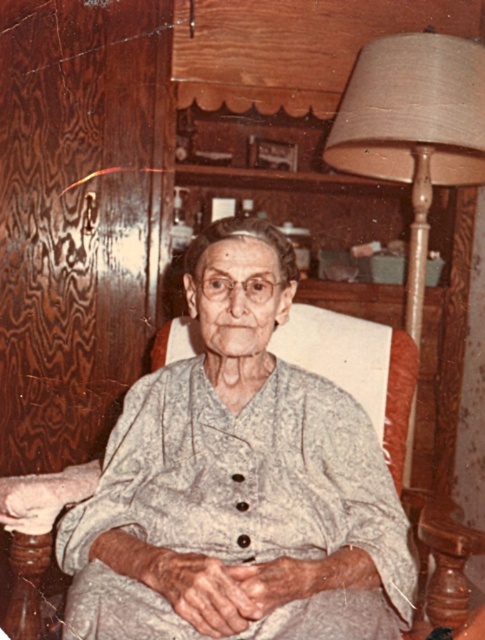
Question: Can you confirm if white textured dress at center is smaller than beige fabric lampshade at right?

Choices:
 (A) yes
 (B) no

Answer: (B)

Question: Which point is farther to the camera?

Choices:
 (A) white textured dress at center
 (B) beige fabric lampshade at right

Answer: (B)

Question: Does white textured dress at center appear on the left side of beige fabric lampshade at right?

Choices:
 (A) no
 (B) yes

Answer: (B)

Question: Does white textured dress at center appear on the left side of beige fabric lampshade at right?

Choices:
 (A) no
 (B) yes

Answer: (B)